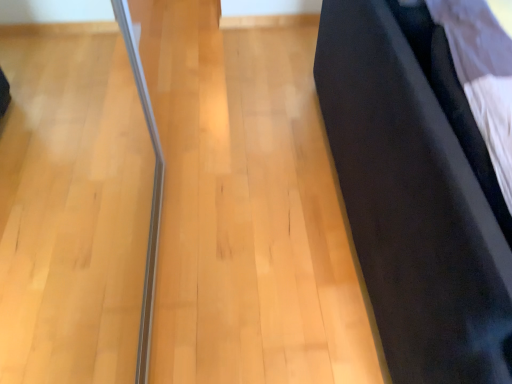
Locate an element on the screen. The image size is (512, 384). black matte curtain at right is located at coordinates (417, 193).

What is the approximate height of black matte curtain at right?

81.43 centimeters.

The image size is (512, 384). Describe the element at coordinates (417, 193) in the screenshot. I see `black matte curtain at right` at that location.

I want to click on black matte curtain at right, so click(417, 193).